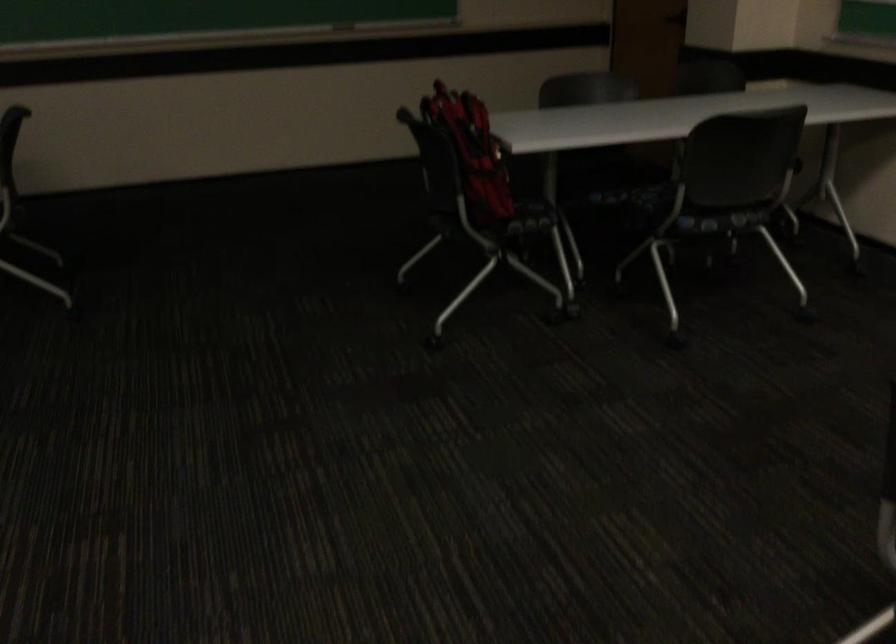
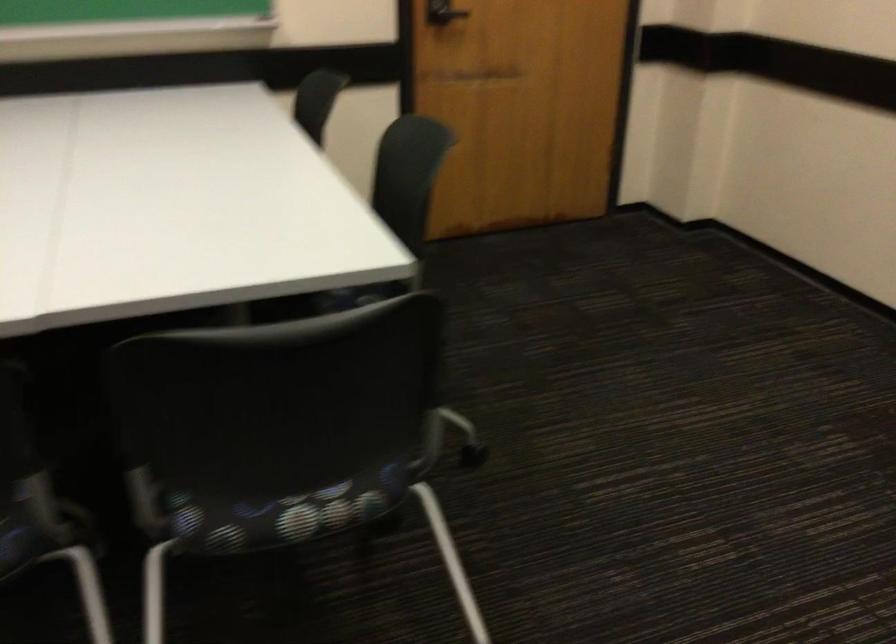
The images are taken continuously from a first-person perspective. In which direction is your viewpoint rotating?

The rotation direction of the camera is right-down.